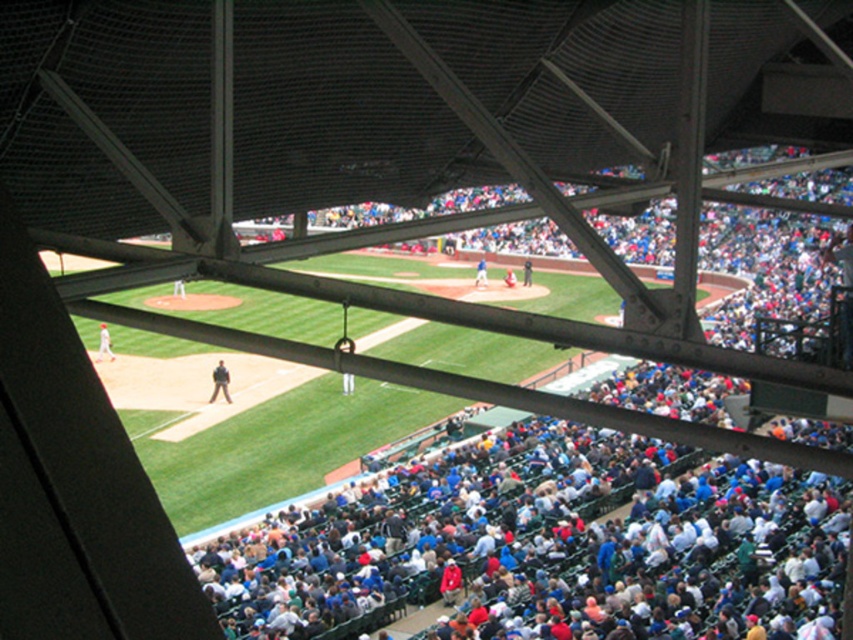
Does light brown leather jacket at center appear under red uniformed person at lower left?

Correct, light brown leather jacket at center is located below red uniformed person at lower left.

Is light brown leather jacket at center further to the viewer compared to red uniformed person at lower left?

No, it is in front of red uniformed person at lower left.

Locate an element on the screen. Image resolution: width=853 pixels, height=640 pixels. light brown leather jacket at center is located at coordinates (219, 381).

Who is lower down, blue jersey at center or dark blue uniform at center?

dark blue uniform at center

Between blue jersey at center and dark blue uniform at center, which one has more height?

blue jersey at center is taller.

Does point (485, 280) come in front of point (527, 273)?

Yes.

Identify the location of blue jersey at center. (480, 273).

Does dark blue uniform at center appear over blue uniformed player at center?

Correct, dark blue uniform at center is located above blue uniformed player at center.

Between dark blue uniform at center and blue uniformed player at center, which one has more height?

With more height is dark blue uniform at center.

Which is in front, point (524, 272) or point (512, 282)?

Point (512, 282) is in front.

Find the location of `dark blue uniform at center`. dark blue uniform at center is located at coordinates (527, 273).